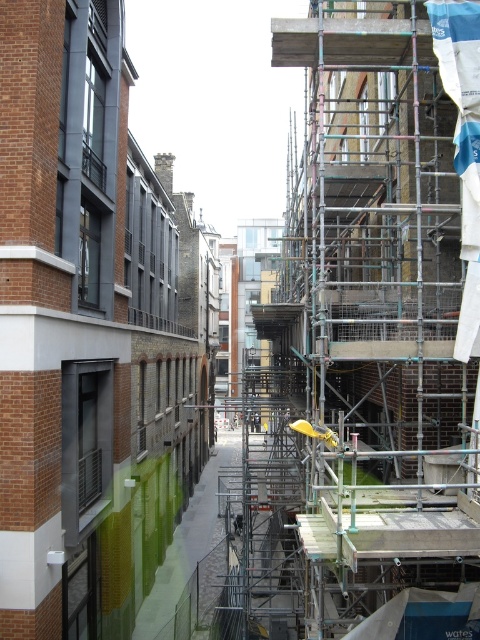
Between green matte wall at center and metal scaffolding at center, which one has more height?

green matte wall at center

Does green matte wall at center appear on the right side of metal scaffolding at center?

No, green matte wall at center is not to the right of metal scaffolding at center.

Who is more forward, (130, 257) or (420, 461)?

Point (420, 461) is in front.

At what (x,y) coordinates should I click in order to perform the action: click on green matte wall at center. Please return your answer as a coordinate pair (x, y). Looking at the image, I should click on click(x=86, y=333).